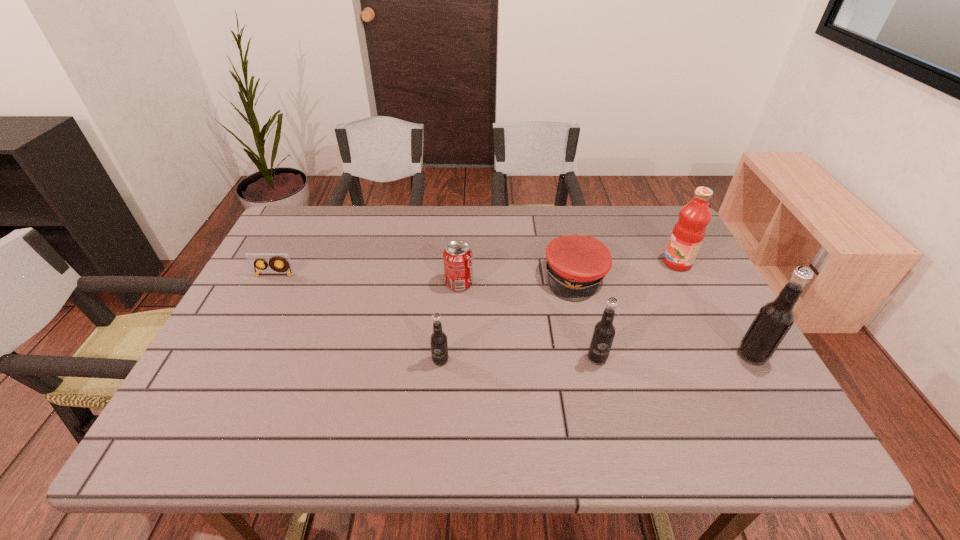
Identify the location of free location located 0.100m on the label of the fourth tallest object. (437, 406).

The image size is (960, 540). Find the location of `vacant space located 0.080m on the label of the second root beer from right to left`. vacant space located 0.080m on the label of the second root beer from right to left is located at coordinates (607, 397).

You are a GUI agent. You are given a task and a screenshot of the screen. Output one action in this format:
    pyautogui.click(x=<x>, y=<y>)
    Task: Click on the free space located 0.100m on the front of the cap with an emblem
    The height and width of the screenshot is (540, 960).
    Given the screenshot: What is the action you would take?
    pyautogui.click(x=588, y=331)

Identify the location of vacant space located on the front label of the fruit juice. (588, 263).

Where is `vacant space located on the front label of the fruit juice`? vacant space located on the front label of the fruit juice is located at coordinates (622, 263).

Where is `vacant space positioned on the front label of the fruit juice`? The image size is (960, 540). vacant space positioned on the front label of the fruit juice is located at coordinates (636, 263).

The height and width of the screenshot is (540, 960). In order to click on vacant area situated 0.330m on the front of the soda can in this screenshot , I will do `click(453, 401)`.

In order to click on free space located at the front of the videotape with visible reels in this screenshot , I will do 260,302.

Locate an element on the screen. Image resolution: width=960 pixels, height=540 pixels. object located at the left edge is located at coordinates (254, 260).

In order to click on root beer that is at the right edge in this screenshot , I will do `click(775, 318)`.